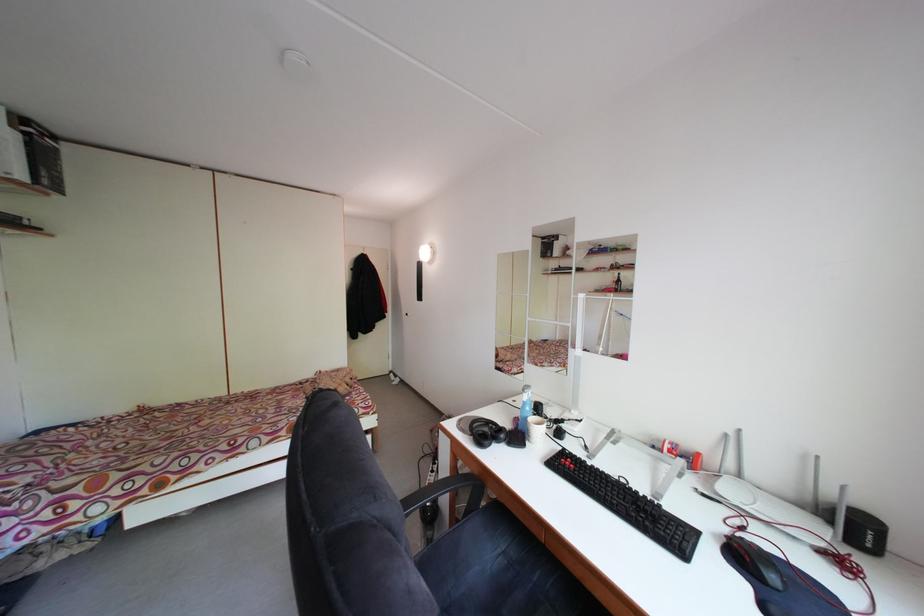
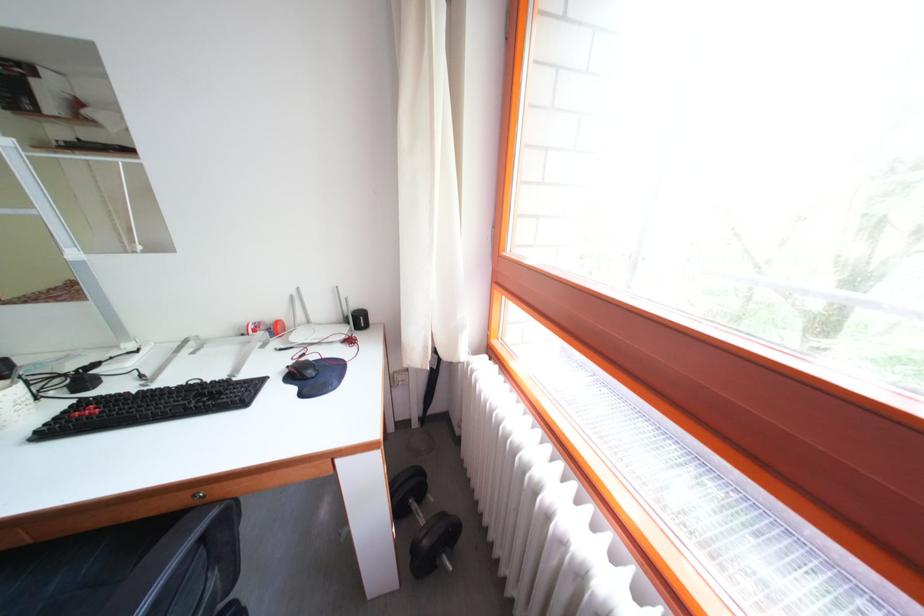
The point at (735, 536) is marked in the first image. Where is the corresponding point in the second image?

(298, 370)